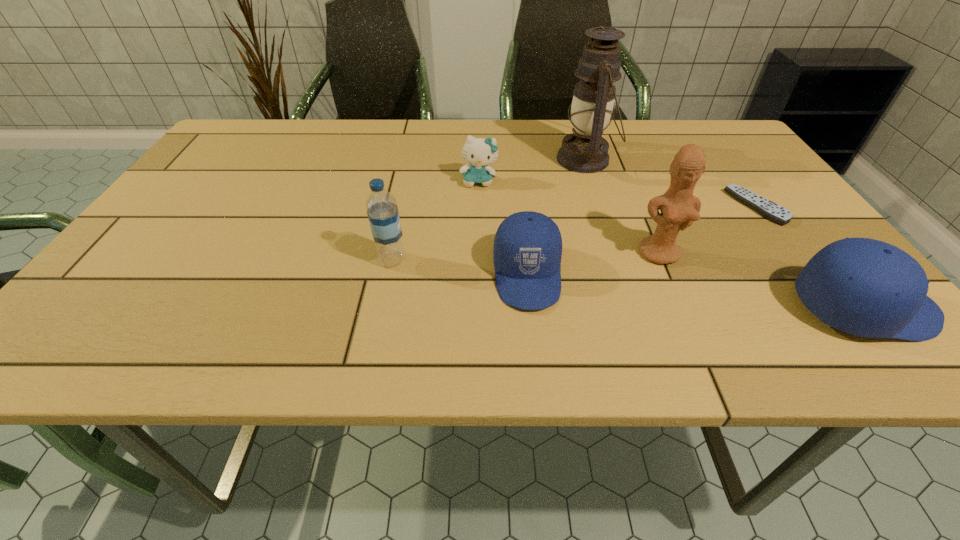
Please point a spot on the left to add another cap. Please provide its 2D coordinates. Your answer should be formatted as a tuple, i.e. [(x, y)], where the tuple contains the x and y coordinates of a point satisfying the conditions above.

[(236, 246)]